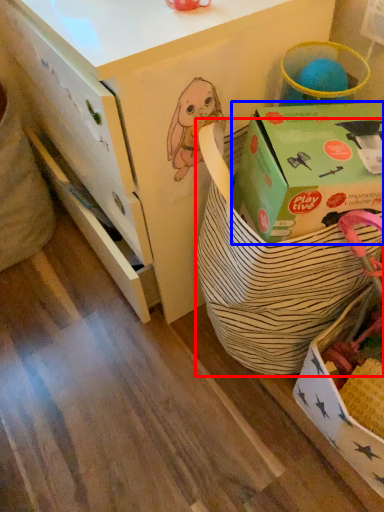
Question: Among these objects, which one is farthest to the camera, gift basket (highlighted by a red box) or box (highlighted by a blue box)?

Choices:
 (A) gift basket
 (B) box

Answer: (B)